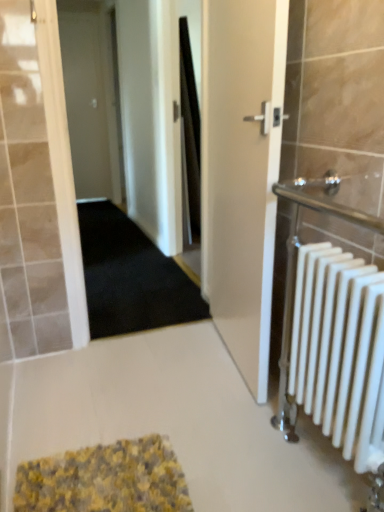
Question: In terms of size, does white matte radiator at right appear bigger or smaller than black carpet at center?

Choices:
 (A) small
 (B) big

Answer: (A)

Question: Choose the correct answer: Is white matte radiator at right inside black carpet at center or outside it?

Choices:
 (A) inside
 (B) outside

Answer: (B)

Question: Estimate the real-world distances between objects in this image. Which object is farther from the white matte door at upper left, the 2th door positioned from the right?

Choices:
 (A) white glossy door at center, the second door positioned from the top
 (B) black carpet at center
 (C) white matte radiator at right
 (D) yellow textured bath mat at lower center

Answer: (C)

Question: Which object is the closest to the white matte door at upper left, the 2th door positioned from the right?

Choices:
 (A) yellow textured bath mat at lower center
 (B) white matte radiator at right
 (C) black carpet at center
 (D) white glossy door at center, arranged as the first door when viewed from the front

Answer: (C)